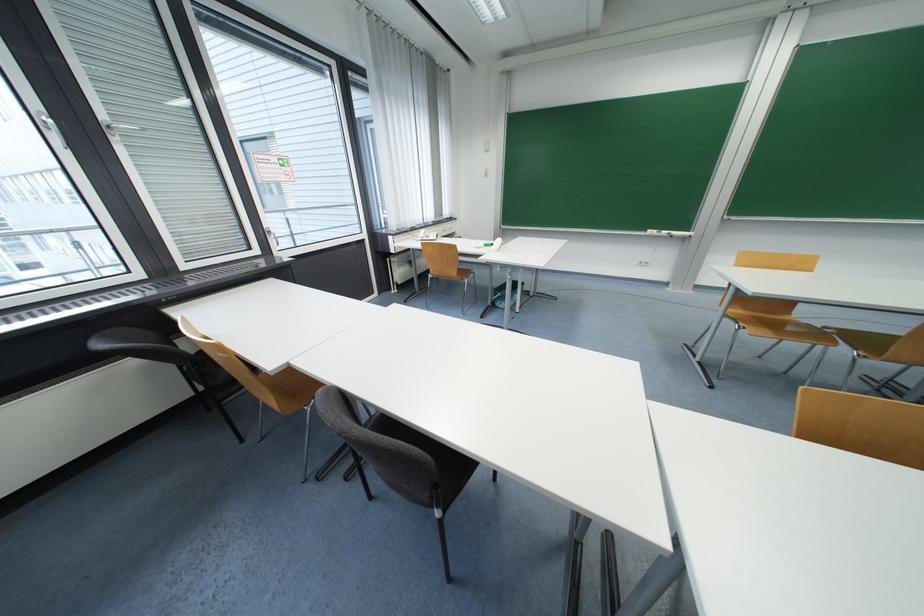
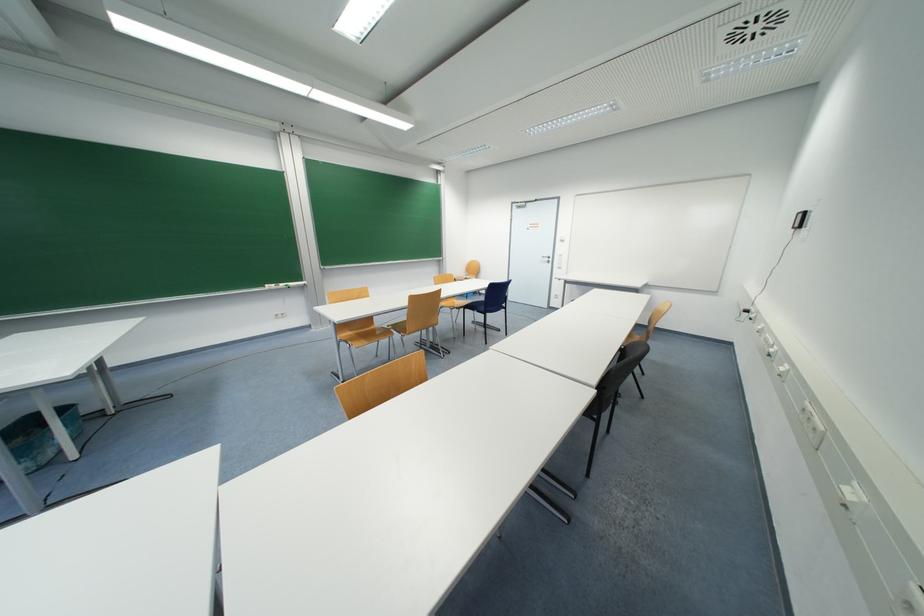
Find the pixel in the second image that matches the point at 758,318 in the first image.

(361, 336)